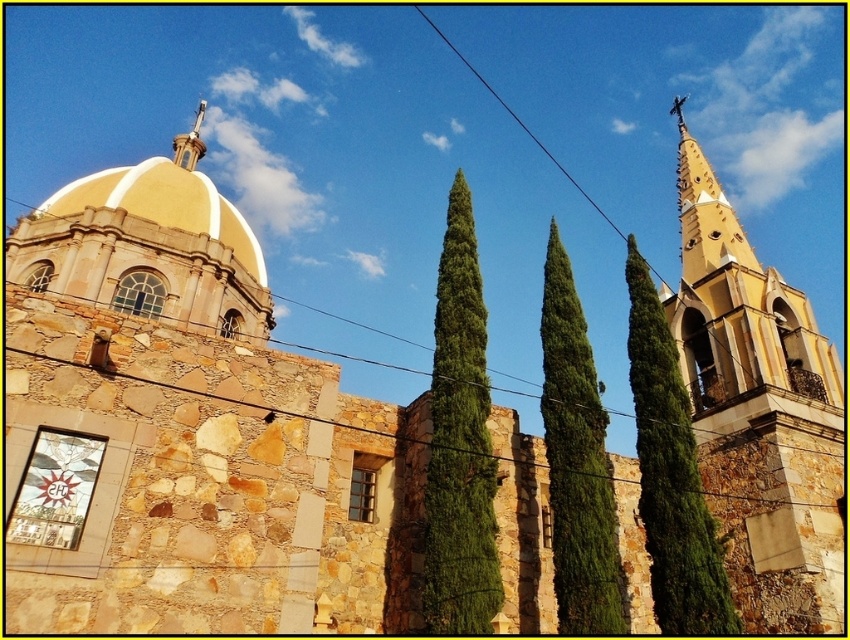
Question: Which of the following is the closest to the observer?

Choices:
 (A) black wire at center
 (B) golden stone dome at upper center
 (C) green textured tree at right

Answer: (C)

Question: Considering the real-world distances, which object is closest to the green textured tree at right?

Choices:
 (A) green leafy tree at center
 (B) golden stone dome at upper center

Answer: (A)

Question: Is green textured tree at center positioned at the back of golden stone dome at upper center?

Choices:
 (A) no
 (B) yes

Answer: (A)

Question: Does green textured tree at right appear on the right side of green textured tree at center?

Choices:
 (A) no
 (B) yes

Answer: (B)

Question: Is green leafy tree at center to the left of golden stone dome at upper center from the viewer's perspective?

Choices:
 (A) no
 (B) yes

Answer: (A)

Question: Which point is closer to the camera taking this photo?

Choices:
 (A) (429, 477)
 (B) (816, 380)
 (C) (700, 611)
 (D) (550, 250)

Answer: (C)